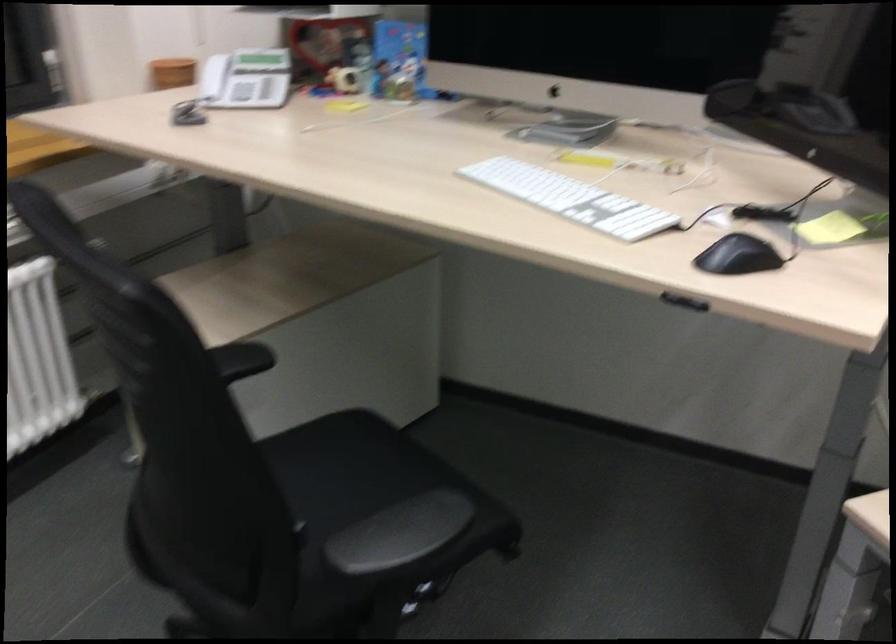
The image size is (896, 644). In order to click on white telephone handset in this screenshot , I will do `click(212, 77)`.